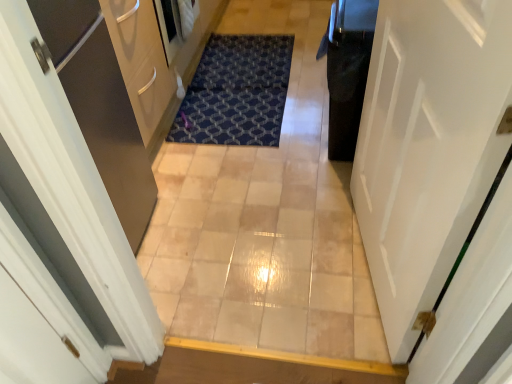
Where is `free space below white glossy door at right (from a real-world perspective)`? The height and width of the screenshot is (384, 512). free space below white glossy door at right (from a real-world perspective) is located at coordinates (362, 264).